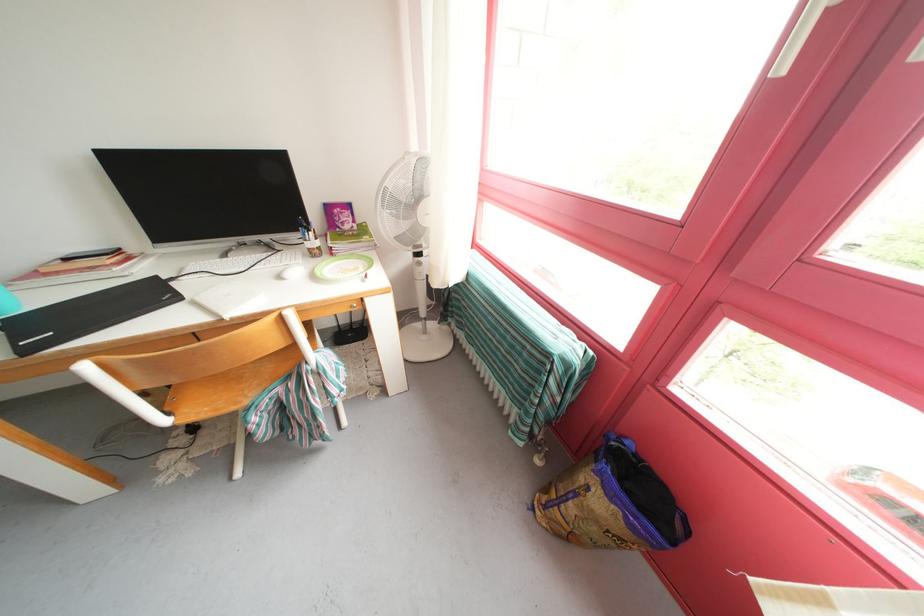
I want to click on white computer mouse, so click(x=292, y=272).